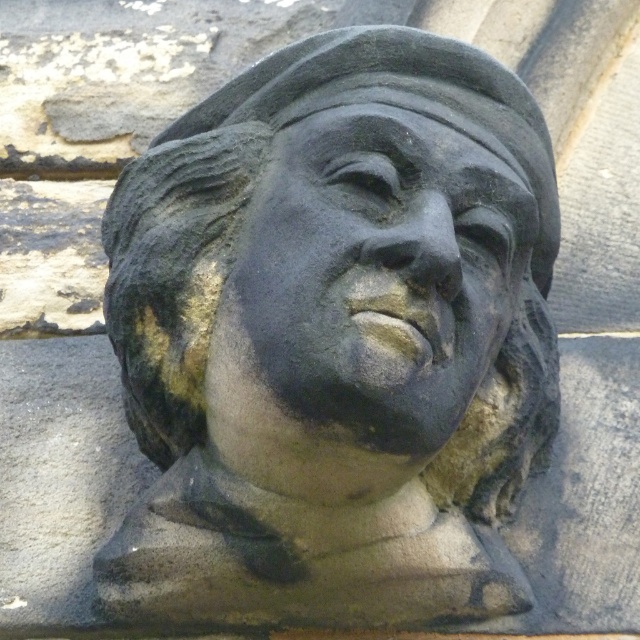
Question: Does black stone bust at center have a greater width compared to matte stone face at center?

Choices:
 (A) yes
 (B) no

Answer: (A)

Question: Does black stone bust at center have a greater width compared to matte stone face at center?

Choices:
 (A) yes
 (B) no

Answer: (A)

Question: Which point is closer to the camera?

Choices:
 (A) matte stone face at center
 (B) black stone bust at center

Answer: (A)

Question: Is black stone bust at center to the left of matte stone face at center from the viewer's perspective?

Choices:
 (A) no
 (B) yes

Answer: (B)

Question: Among these points, which one is nearest to the camera?

Choices:
 (A) (480, 364)
 (B) (312, 291)

Answer: (B)